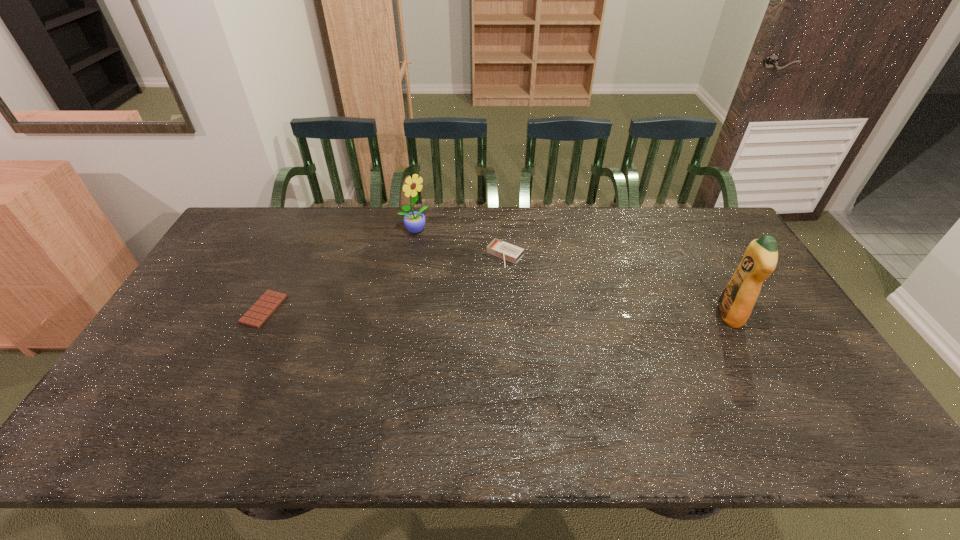
This screenshot has height=540, width=960. In order to click on the shortest object in this screenshot , I will do `click(270, 300)`.

Find the location of a particular element. candy bar is located at coordinates (270, 300).

Where is `the tallest object`? The height and width of the screenshot is (540, 960). the tallest object is located at coordinates (737, 300).

The image size is (960, 540). Identify the location of the rightmost object. (737, 300).

You are a GUI agent. You are given a task and a screenshot of the screen. Output one action in this format:
    pyautogui.click(x=<x>, y=<y>)
    Task: Click on the second shortest object
    
    Given the screenshot: What is the action you would take?
    pyautogui.click(x=504, y=250)

Locate an element on the screen. matchbox is located at coordinates (504, 250).

Locate an element on the screen. The width and height of the screenshot is (960, 540). the third object from right to left is located at coordinates (414, 221).

Where is `the farthest object`? This screenshot has height=540, width=960. the farthest object is located at coordinates (414, 221).

At what (x,y) coordinates should I click in order to perform the action: click on blank area located 0.090m on the right of the shortest object. Please return your answer as a coordinate pair (x, y). This screenshot has width=960, height=540. Looking at the image, I should click on (312, 309).

You are a GUI agent. You are given a task and a screenshot of the screen. Output one action in this format:
    pyautogui.click(x=<x>, y=<y>)
    Task: Click on the free space located on the label of the detergent
    The image size is (960, 540).
    Given the screenshot: What is the action you would take?
    pyautogui.click(x=701, y=315)